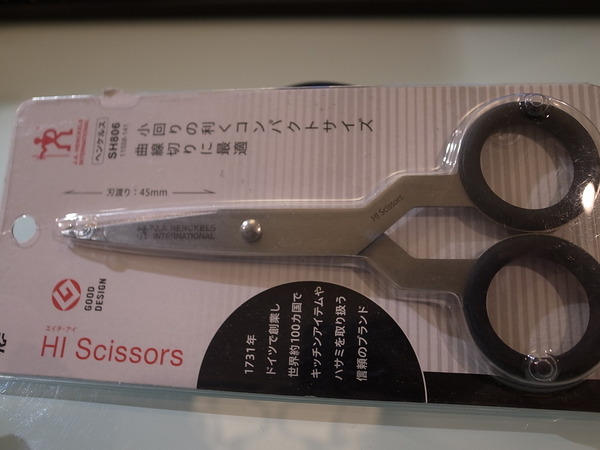
Identify the location of handle. This screenshot has width=600, height=450. tap(526, 215), tap(551, 252).